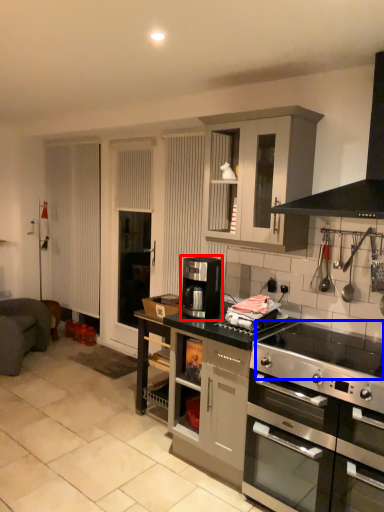
Question: Which point is further to the camera, coffee machine (highlighted by a red box) or gas stove (highlighted by a blue box)?

Choices:
 (A) coffee machine
 (B) gas stove

Answer: (A)